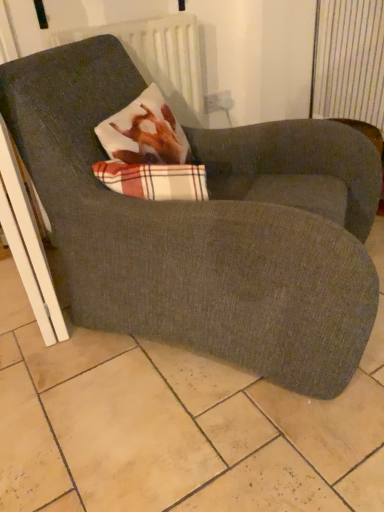
Where is `blank space situated above white textured radiator at upper center (from a real-world perspective)`? blank space situated above white textured radiator at upper center (from a real-world perspective) is located at coordinates (127, 19).